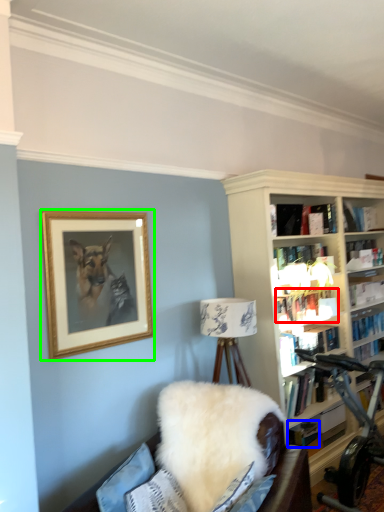
Question: Which object is positioned closest to book (highlighted by a red box)? Select from book (highlighted by a blue box) and picture frame (highlighted by a green box).

Choices:
 (A) book
 (B) picture frame

Answer: (A)